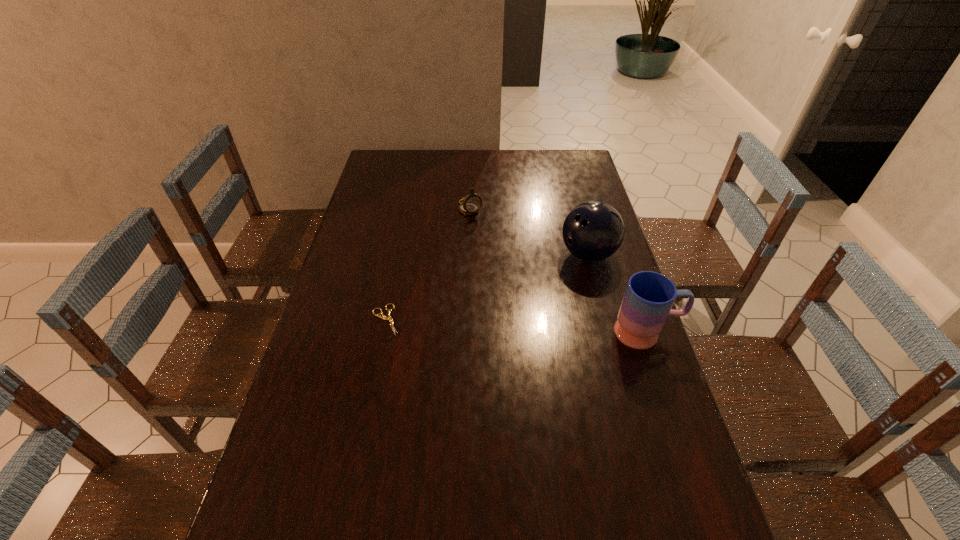
Find the location of a particular element. the second closest object to the compass is located at coordinates (389, 318).

Find the location of `free space that satisfies the following two spatial constraints: 1. on the front side of the farthest object; 2. on the right side of the second farthest object`. free space that satisfies the following two spatial constraints: 1. on the front side of the farthest object; 2. on the right side of the second farthest object is located at coordinates (469, 254).

Locate an element on the screen. This screenshot has height=540, width=960. vacant space that satisfies the following two spatial constraints: 1. on the front side of the shortest object; 2. on the side of the mug with the handle is located at coordinates (383, 333).

Where is `vacant space that satisfies the following two spatial constraints: 1. on the front side of the third object from right to left; 2. on the side of the mug with the handle`? The image size is (960, 540). vacant space that satisfies the following two spatial constraints: 1. on the front side of the third object from right to left; 2. on the side of the mug with the handle is located at coordinates (467, 333).

This screenshot has height=540, width=960. I want to click on blank space that satisfies the following two spatial constraints: 1. on the front side of the bowling ball; 2. on the right side of the compass, so click(x=469, y=254).